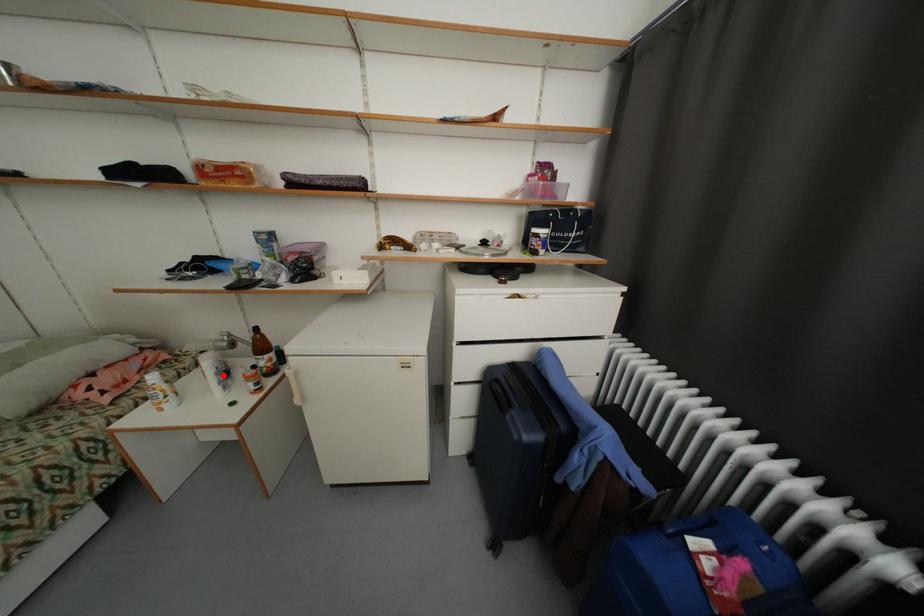
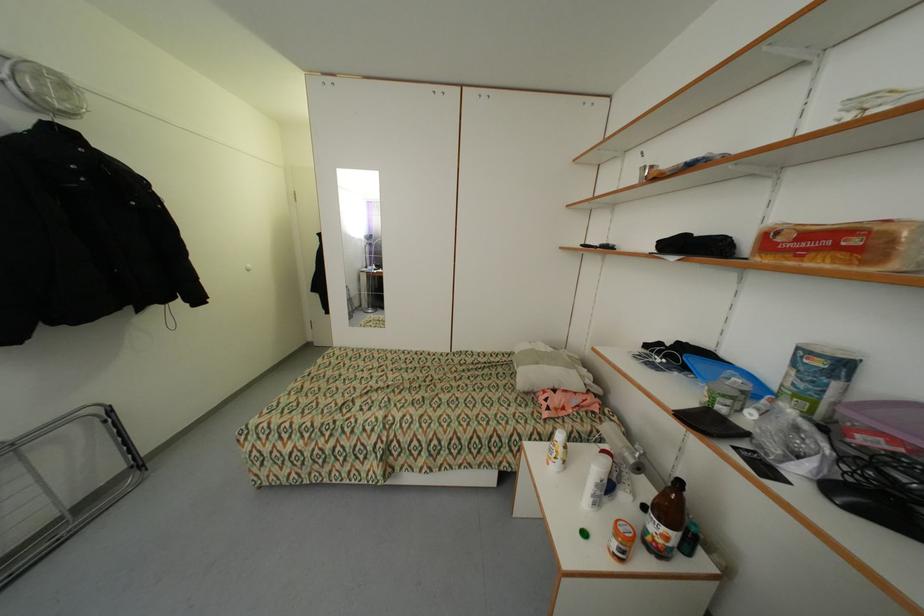
Locate, in the second image, the point that corresponds to the highlighted location in the first image.

(603, 487)